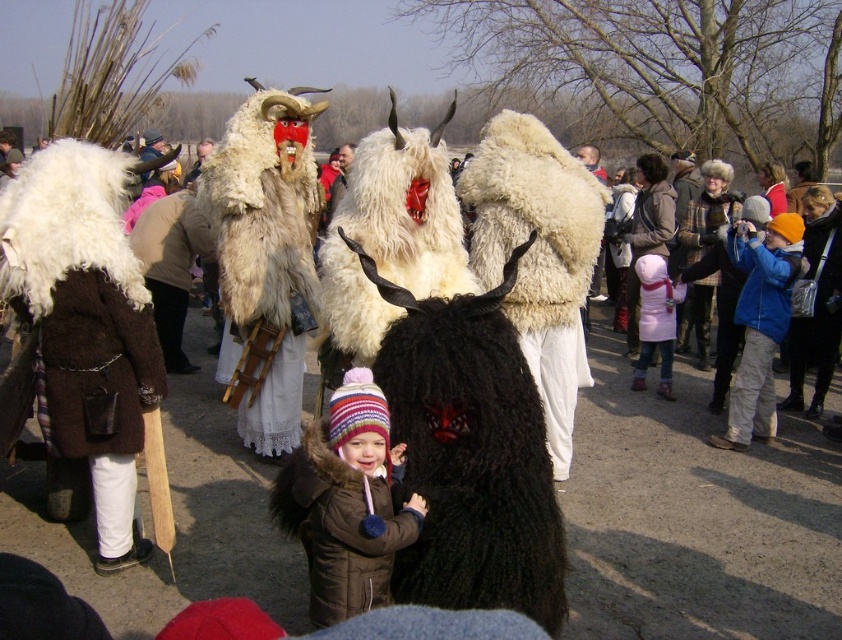
Who is more distant from viewer, (440, 440) or (332, 212)?

The point (332, 212) is behind.

At what (x,y) coordinates should I click in order to perform the action: click on black woolen mask at center. Please return your answer as a coordinate pair (x, y). Looking at the image, I should click on (470, 452).

Between point (745, 435) and point (328, 200), which one is positioned in front?

Positioned in front is point (745, 435).

Which of these two, blue fleece jacket at right or furry costume at center, stands taller?

With more height is blue fleece jacket at right.

Image resolution: width=842 pixels, height=640 pixels. What do you see at coordinates (760, 323) in the screenshot?
I see `blue fleece jacket at right` at bounding box center [760, 323].

Where is `blue fleece jacket at right`? The height and width of the screenshot is (640, 842). blue fleece jacket at right is located at coordinates (760, 323).

Does black woolen mask at center appear over blue fleece jacket at right?

Incorrect, black woolen mask at center is not positioned above blue fleece jacket at right.

The height and width of the screenshot is (640, 842). I want to click on black woolen mask at center, so click(x=470, y=452).